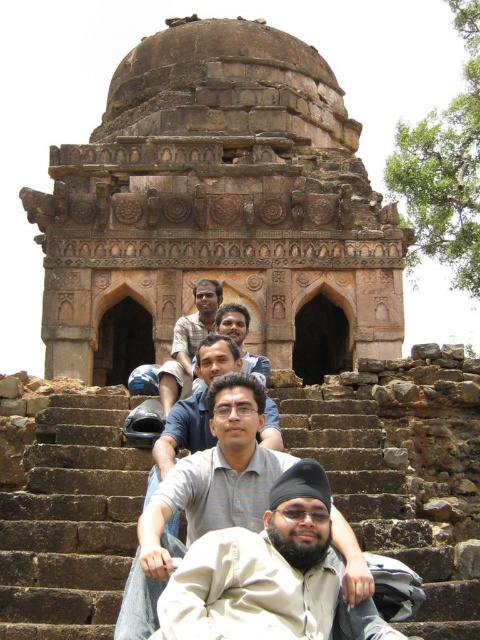
You are standing at the bottom of the stone steps leading to the monument. You notice a point marked at coordinates (217, 209). What does this point indicate?

The point at (217, 209) marks the location of brown stone ruins at center.

You are standing in front of the ancient stone monument and notice two points marked on the structure. The first point is at coordinates point (164, 560) and the second is at point (201, 289). Which of these points is nearer to your current position?

Point (164, 560) is closer to the camera than point (201, 289), so the first point is nearer to your current position.